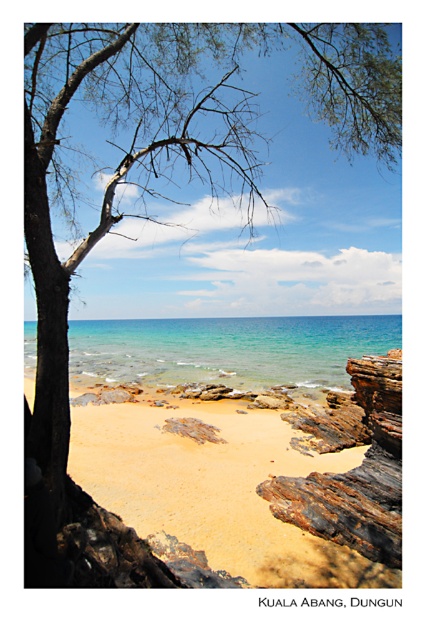
You are standing at the beach in the image and want to walk towards the two points marked. Which point, point (219,330) or point (338,497), will you reach first?

You will reach point (219,330) first because it is closer to you than point (338,497), which is further away.

You are standing at the beach in Kuala Abang, Dungun, and notice two points marked on the sand. The first point is at coordinate point [241,435] and the second is at point [259,376]. Which point is closer to your current position?

Point [241,435] is closer to the camera than point [259,376], so the first point is closer to your current position.

You are standing on the golden sand beach at center and want to reach the clear blue water at center. According to the scene, which direction should you move towards?

The golden sand beach at center is to the left of clear blue water at center, so you should move towards the right to reach the clear blue water at center.